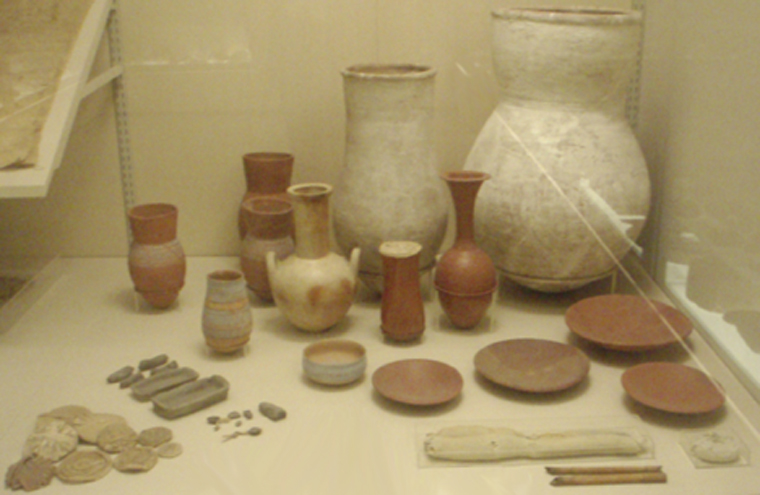
Find the location of `bowl`. bowl is located at coordinates (343, 371).